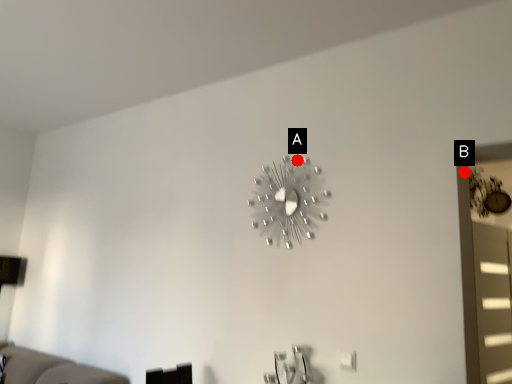
Question: Two points are circled on the image, labeled by A and B beside each circle. Among these points, which one is farthest from the camera?

Choices:
 (A) A is further
 (B) B is further

Answer: (A)